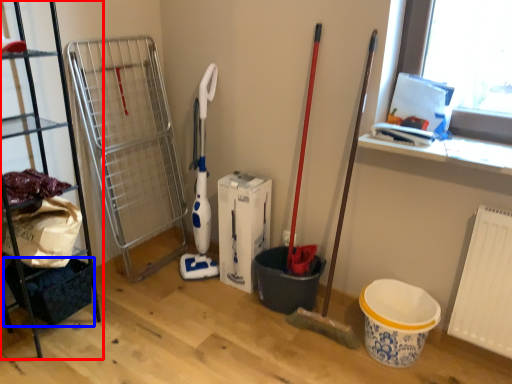
Question: Which object appears farthest to the camera in this image, shelf (highlighted by a red box) or basket (highlighted by a blue box)?

Choices:
 (A) shelf
 (B) basket

Answer: (B)